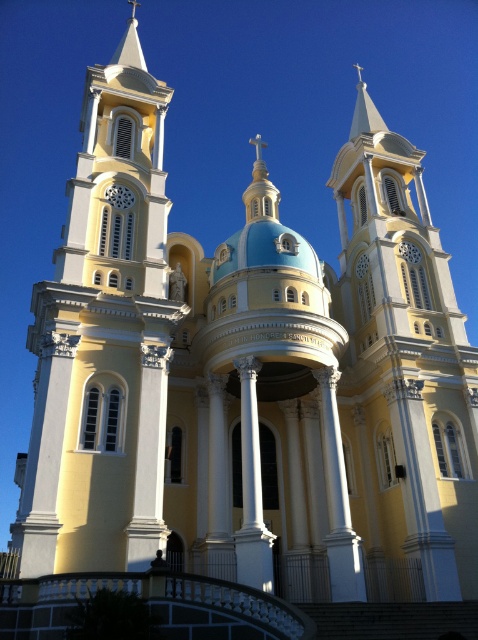
Question: Can you confirm if matte yellow tower at center is thinner than white glossy column at center?

Choices:
 (A) no
 (B) yes

Answer: (A)

Question: Among these points, which one is farthest from the camera?

Choices:
 (A) (268, 557)
 (B) (334, 516)
 (C) (149, 403)

Answer: (B)

Question: Observing the image, what is the correct spatial positioning of matte yellow tower at center in reference to white glossy column at center?

Choices:
 (A) above
 (B) below

Answer: (A)

Question: Estimate the real-world distances between objects in this image. Which object is closer to the white glossy column at center?

Choices:
 (A) matte yellow tower at center
 (B) white marble column at center

Answer: (B)

Question: Does matte yellow tower at center appear on the left side of white marble column at center?

Choices:
 (A) no
 (B) yes

Answer: (B)

Question: Which is nearer to the matte yellow tower at center?

Choices:
 (A) white marble column at center
 (B) white glossy column at center

Answer: (A)